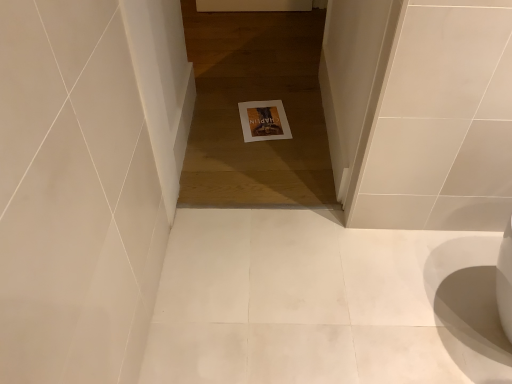
You are a GUI agent. You are given a task and a screenshot of the screen. Output one action in this format:
    pyautogui.click(x=<x>, y=<y>)
    Task: Click on the white paper at center
    
    Given the screenshot: What is the action you would take?
    pyautogui.click(x=255, y=100)

What is the approximate width of white paper at center?

It is 6.11 feet.

The height and width of the screenshot is (384, 512). What do you see at coordinates (255, 100) in the screenshot?
I see `white paper at center` at bounding box center [255, 100].

Locate an element on the screen. The width and height of the screenshot is (512, 384). white paper at center is located at coordinates point(264,121).

The image size is (512, 384). Describe the element at coordinates (264, 121) in the screenshot. I see `white paper at center` at that location.

You are a GUI agent. You are given a task and a screenshot of the screen. Output one action in this format:
    pyautogui.click(x=<x>, y=<y>)
    Task: Click on the white paper at center
    
    Given the screenshot: What is the action you would take?
    pyautogui.click(x=255, y=100)

Based on the photo, which is more to the right, white paper at center or white paper at center?

white paper at center.

Considering the positions of objects white paper at center and white paper at center in the image provided, who is in front, white paper at center or white paper at center?

white paper at center is in front.

Between point (239, 143) and point (249, 122), which one is positioned in front?

Point (239, 143)

From the image's perspective, would you say white paper at center is shown under white paper at center?

Actually, white paper at center appears above white paper at center in the image.

From a real-world perspective, which object rests below the other?

In real-world perspective, white paper at center is lower.

Does white paper at center have a greater width compared to white paper at center?

Indeed, white paper at center has a greater width compared to white paper at center.

From their relative heights in the image, would you say white paper at center is taller or shorter than white paper at center?

In the image, white paper at center appears to be taller than white paper at center.

Considering the sizes of objects white paper at center and white paper at center in the image provided, who is bigger, white paper at center or white paper at center?

Bigger between the two is white paper at center.

Is white paper at center outside of white paper at center?

white paper at center is positioned outside white paper at center.

Is white paper at center far from white paper at center?

No.

Could you tell me if white paper at center is turned towards white paper at center?

Yes, white paper at center is facing white paper at center.

How far apart are white paper at center and white paper at center?

white paper at center and white paper at center are 11.19 inches apart.

Find the location of a particular element. passage that is on the left side of white paper at center is located at coordinates (255, 100).

Is white paper at center at the left side of white paper at center?

Incorrect, white paper at center is not on the left side of white paper at center.

Is white paper at center in front of or behind white paper at center in the image?

In the image, white paper at center appears behind white paper at center.

Between point (254, 123) and point (241, 148), which one is positioned in front?

Positioned in front is point (241, 148).

From the image's perspective, is white paper at center beneath white paper at center?

Yes, from the image's perspective, white paper at center is below white paper at center.

From a real-world perspective, is white paper at center located higher than white paper at center?

Incorrect, from a real-world perspective, white paper at center is lower than white paper at center.

Looking at their sizes, would you say white paper at center is wider or thinner than white paper at center?

Considering their sizes, white paper at center looks slimmer than white paper at center.

Is white paper at center taller than white paper at center?

No.

Looking at the image, does white paper at center seem bigger or smaller compared to white paper at center?

Clearly, white paper at center is smaller in size than white paper at center.

Is white paper at center a part of white paper at center?

Actually, white paper at center is outside white paper at center.

Looking at this image, is white paper at center positioned far away from white paper at center?

Actually, white paper at center and white paper at center are a little close together.

Is white paper at center facing towards white paper at center?

Yes, white paper at center is aimed at white paper at center.

How many degrees apart are the facing directions of white paper at center and white paper at center?

6.77 degrees separate the facing orientations of white paper at center and white paper at center.

Identify the location of passage above the white paper at center (from the image's perspective). (255, 100).

At what (x,y) coordinates should I click in order to perform the action: click on postcard below the white paper at center (from a real-world perspective). Please return your answer as a coordinate pair (x, y). The width and height of the screenshot is (512, 384). Looking at the image, I should click on (264, 121).

I want to click on postcard below the white paper at center (from the image's perspective), so click(x=264, y=121).